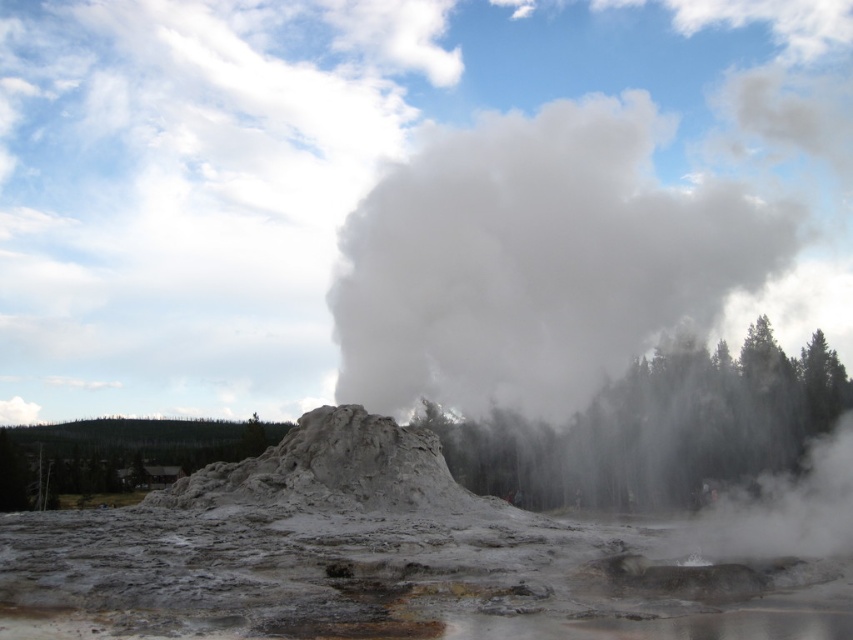
Is white steam at center wider than gray mud volcano at center?

Indeed, white steam at center has a greater width compared to gray mud volcano at center.

Does white steam at center appear on the left side of gray mud volcano at center?

Yes, white steam at center is to the left of gray mud volcano at center.

Who is more distant from viewer, (573,90) or (379,451)?

Positioned behind is point (573,90).

Find the location of a particular element. The height and width of the screenshot is (640, 853). white steam at center is located at coordinates (408, 196).

Does white steam at center appear under white vapor at center?

Actually, white steam at center is above white vapor at center.

Is point (584, 308) more distant than point (474, 406)?

That is True.

The image size is (853, 640). Describe the element at coordinates (408, 196) in the screenshot. I see `white steam at center` at that location.

Where is `white steam at center`? This screenshot has height=640, width=853. white steam at center is located at coordinates (408, 196).

Which of these two, white vapor at center or gray mud volcano at center, stands taller?

With more height is white vapor at center.

Does white vapor at center come behind gray mud volcano at center?

Yes, white vapor at center is further from the viewer.

Describe the element at coordinates (537, 260) in the screenshot. Image resolution: width=853 pixels, height=640 pixels. I see `white vapor at center` at that location.

I want to click on white vapor at center, so click(537, 260).